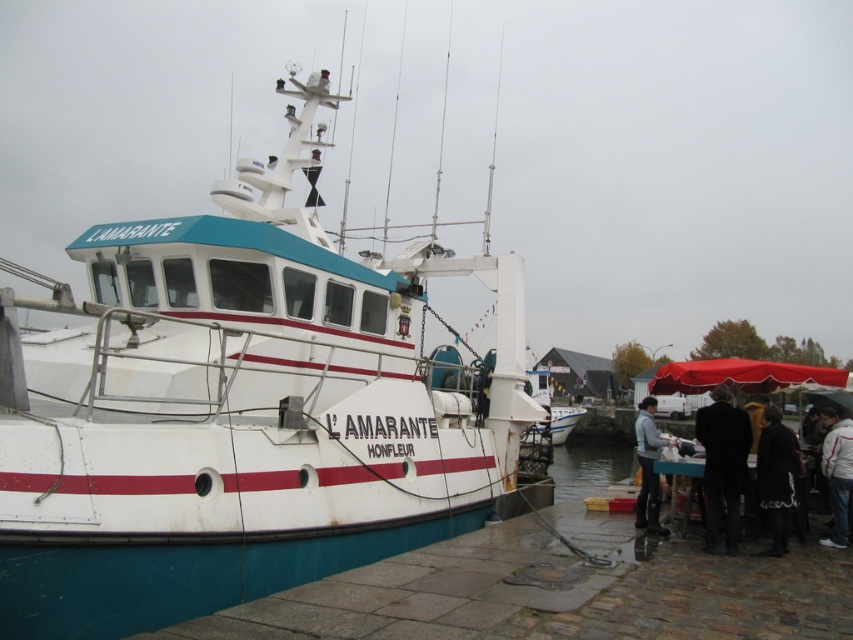
You are standing at the entrance of the marina and see the black wool coat at lower right and the light gray fabric jacket at lower right. If you want to pick up both items, which one should you go to first to minimize the distance walked?

The black wool coat at lower right and light gray fabric jacket at lower right are 6.79 meters apart from each other. To minimize the distance walked, you should pick up one item first and then walk the 6.79 meters to the other. There is no difference in the total distance walked regardless of which you choose first.

You are standing on the pier at the marina and notice two coats hanging on a post. The coats are the black wool coat at lower right and the dark gray wool coat at lower right. Which coat is positioned higher on the post?

The black wool coat at lower right is located above the dark gray wool coat at lower right, so the black wool coat at lower right is positioned higher on the post.

You are a photographer at the marina and want to capture both the dark gray wool coat at lower right and the white fabric jacket at lower right in the same frame. Since you can only focus on one subject at a time, which item should you focus on to ensure the other remains in the background?

You should focus on the dark gray wool coat at lower right because it is positioned to the left of the white fabric jacket at lower right, so the white fabric jacket at lower right will naturally appear in the background when the coat is in focus.